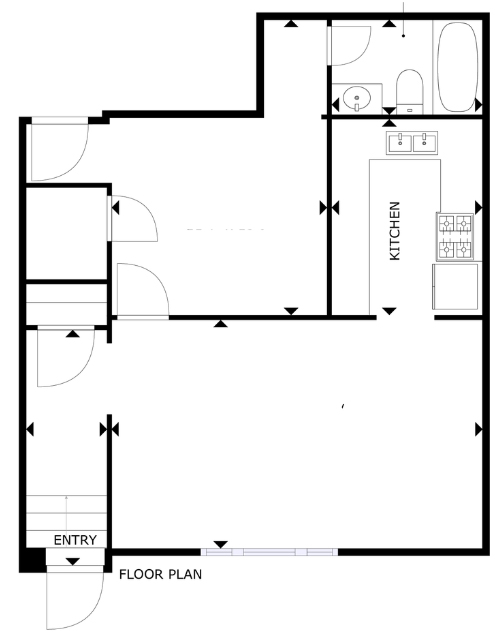
Locate an element on the screen. The width and height of the screenshot is (500, 642). sink is located at coordinates (401, 142), (363, 103), (421, 144).